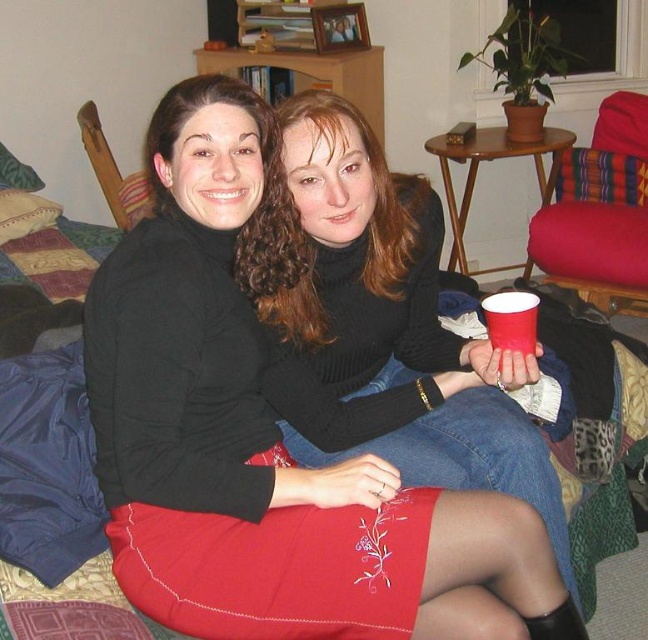
Question: Does black turtleneck sweater at center lie in front of red paper cup at lower right?

Choices:
 (A) yes
 (B) no

Answer: (A)

Question: Is matte black sweater at center bigger than red paper cup at lower right?

Choices:
 (A) no
 (B) yes

Answer: (B)

Question: Which point is closer to the camera?

Choices:
 (A) (294, 180)
 (B) (564, 580)
 (C) (515, 291)
 (D) (389, 204)

Answer: (A)

Question: Which of these objects is positioned farthest from the matte black sweater at center?

Choices:
 (A) black turtleneck sweater at center
 (B) embroidered satin skirt at lower center
 (C) red paper cup at lower right

Answer: (C)

Question: Where is matte black sweater at center located in relation to embroidered satin skirt at lower center in the image?

Choices:
 (A) above
 (B) below

Answer: (A)

Question: Among these points, which one is farthest from the camera?

Choices:
 (A) (x=520, y=292)
 (B) (x=437, y=452)
 (C) (x=410, y=214)

Answer: (C)